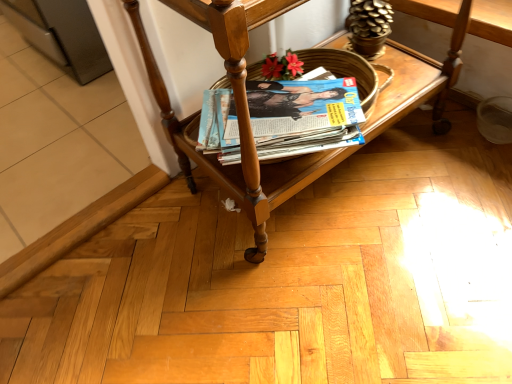
This screenshot has width=512, height=384. Find the location of `vacant area that is in front of wooden magazine rack at center`. vacant area that is in front of wooden magazine rack at center is located at coordinates (359, 278).